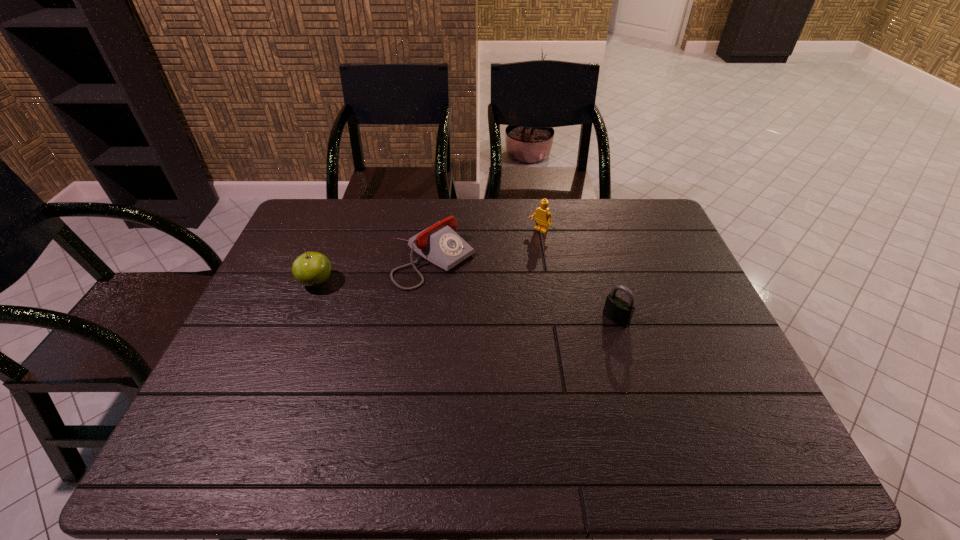
Identify which object is located as the nearest to the Lego. Please provide its 2D coordinates. Your answer should be formatted as a tuple, i.e. [(x, y)], where the tuple contains the x and y coordinates of a point satisfying the conditions above.

[(440, 244)]

Identify the location of object that is the third nearest to the leftmost object. (620, 312).

Image resolution: width=960 pixels, height=540 pixels. In order to click on free spot that satisfies the following two spatial constraints: 1. on the back side of the telephone; 2. on the left side of the Lego in this screenshot , I will do `click(438, 231)`.

This screenshot has height=540, width=960. In order to click on vacant space that satisfies the following two spatial constraints: 1. on the front side of the nearest object; 2. on the left side of the Lego in this screenshot , I will do `click(553, 319)`.